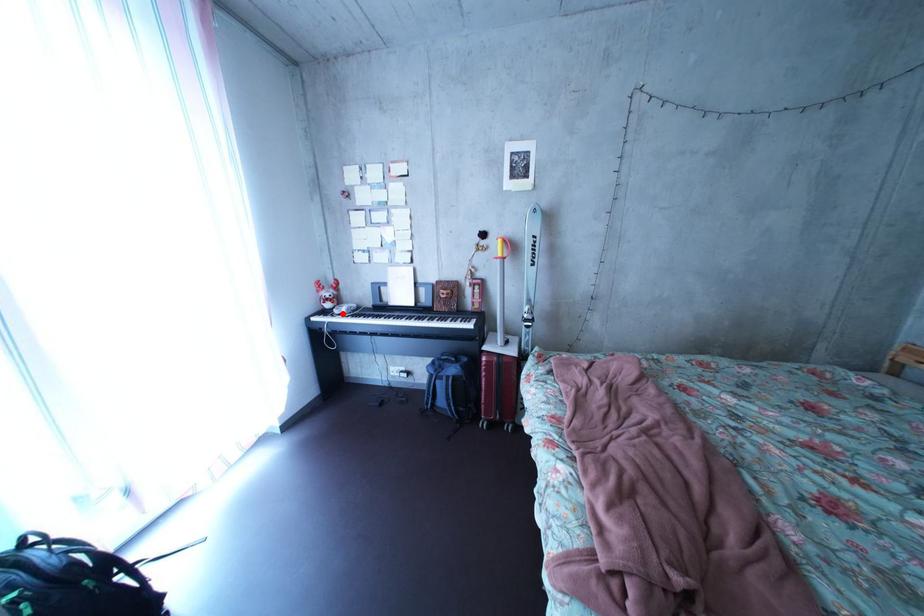
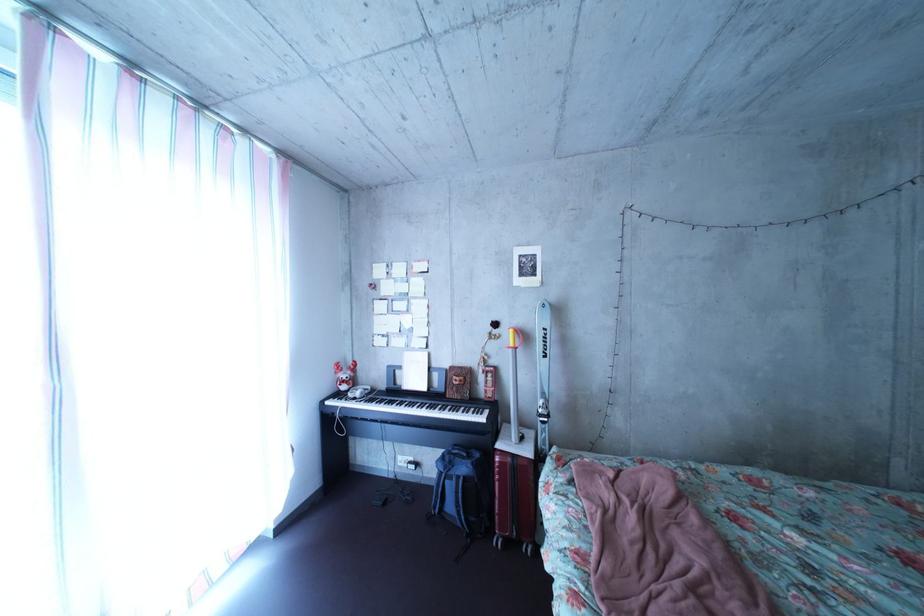
Question: I am providing you with two images of the same scene from different viewpoints. In image1, a red point is highlighted. Considering the same 3D point in image2, which of the following is correct?

Choices:
 (A) It is closer
 (B) It is farther

Answer: (B)